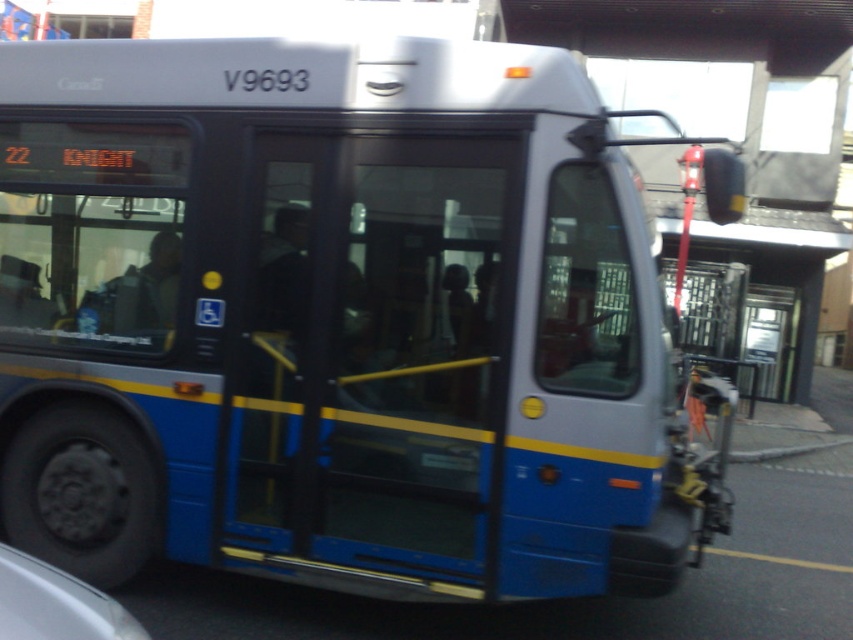
Question: Is blue metallic door at center positioned in front of white glossy car at lower left?

Choices:
 (A) yes
 (B) no

Answer: (B)

Question: Which point appears closest to the camera in this image?

Choices:
 (A) (x=315, y=150)
 (B) (x=84, y=598)

Answer: (B)

Question: Is blue metallic door at center closer to the viewer compared to white glossy car at lower left?

Choices:
 (A) yes
 (B) no

Answer: (B)

Question: Can you confirm if blue metallic door at center is positioned to the left of white glossy car at lower left?

Choices:
 (A) yes
 (B) no

Answer: (B)

Question: Which point is farther to the camera?

Choices:
 (A) (25, 608)
 (B) (479, 154)

Answer: (B)

Question: Which object is farther from the camera taking this photo?

Choices:
 (A) blue metallic door at center
 (B) white glossy car at lower left

Answer: (A)